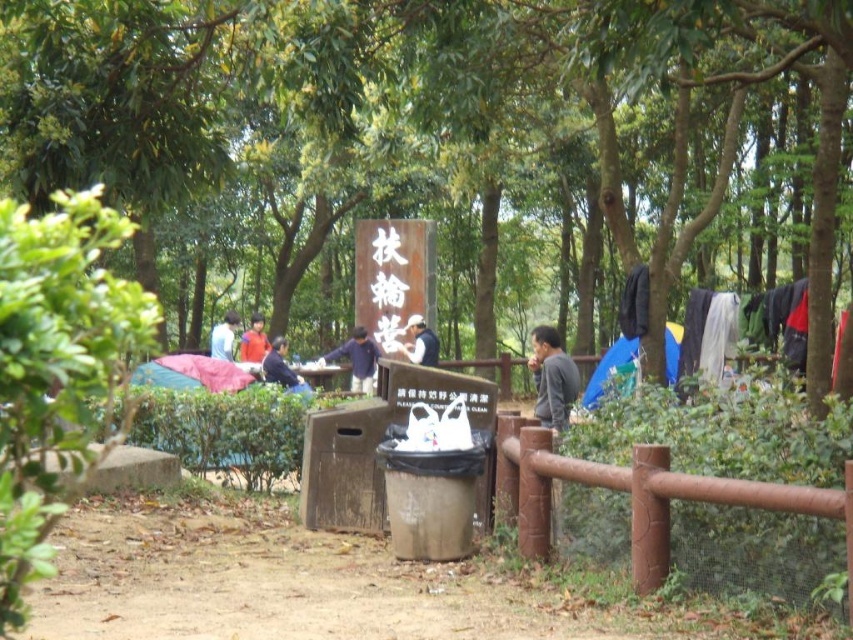
Question: Does green leafy tree at center have a smaller size compared to orange fabric at center?

Choices:
 (A) yes
 (B) no

Answer: (B)

Question: Can you confirm if green leafy tree at center is positioned above gray matte jacket at center?

Choices:
 (A) no
 (B) yes

Answer: (B)

Question: Based on their relative distances, which object is nearer to the orange fabric at center?

Choices:
 (A) gray matte jacket at center
 (B) light blue fabric at center
 (C) light blue shirt at center
 (D) dark blue shirt at center

Answer: (B)

Question: Which object is the farthest from the gray matte jacket at center?

Choices:
 (A) orange fabric at center
 (B) dark blue shirt at center

Answer: (A)

Question: Is the position of orange fabric at center less distant than that of light blue fabric at center?

Choices:
 (A) no
 (B) yes

Answer: (A)

Question: Among these objects, which one is farthest from the camera?

Choices:
 (A) light blue shirt at center
 (B) orange fabric at center
 (C) dark blue shirt at center

Answer: (B)